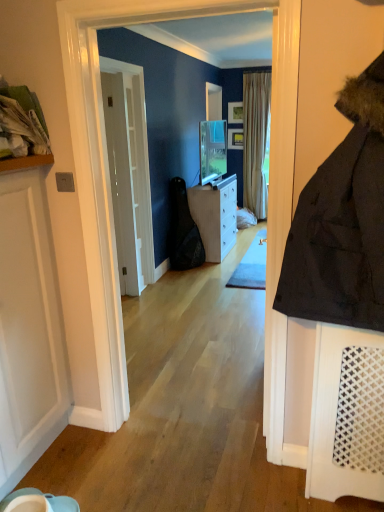
Question: Is white matte door at left, marked as the 2th door in a back-to-front arrangement, taller than white glossy cabinet at center?

Choices:
 (A) yes
 (B) no

Answer: (A)

Question: From the image's perspective, is white matte door at left, marked as the 2th door in a back-to-front arrangement, beneath white glossy cabinet at center?

Choices:
 (A) yes
 (B) no

Answer: (A)

Question: From the image's perspective, would you say white matte door at left, the 1th door viewed from the front, is positioned over white glossy cabinet at center?

Choices:
 (A) no
 (B) yes

Answer: (A)

Question: Considering the relative sizes of white matte door at left, the 1th door viewed from the front, and white glossy cabinet at center in the image provided, is white matte door at left, the 1th door viewed from the front, smaller than white glossy cabinet at center?

Choices:
 (A) yes
 (B) no

Answer: (A)

Question: Does white matte door at left, marked as the 2th door in a back-to-front arrangement, turn towards white glossy cabinet at center?

Choices:
 (A) no
 (B) yes

Answer: (A)

Question: Can you confirm if white matte door at left, the 1th door viewed from the front, is positioned to the left of white glossy cabinet at center?

Choices:
 (A) yes
 (B) no

Answer: (A)

Question: Considering the relative sizes of white glossy cabinet at center and white matte door at left, marked as the 2th door in a back-to-front arrangement, in the image provided, is white glossy cabinet at center taller than white matte door at left, marked as the 2th door in a back-to-front arrangement,?

Choices:
 (A) no
 (B) yes

Answer: (A)

Question: Can you confirm if white glossy cabinet at center is wider than white matte door at left, marked as the 2th door in a back-to-front arrangement?

Choices:
 (A) no
 (B) yes

Answer: (B)

Question: Could you tell me if white glossy cabinet at center is turned towards white matte door at left, marked as the 2th door in a back-to-front arrangement?

Choices:
 (A) no
 (B) yes

Answer: (A)

Question: Does white glossy cabinet at center contain white matte door at left, the 1th door viewed from the front?

Choices:
 (A) no
 (B) yes

Answer: (A)

Question: Is white glossy cabinet at center far away from white matte door at left, the 1th door viewed from the front?

Choices:
 (A) yes
 (B) no

Answer: (A)

Question: Considering the relative positions of white glossy cabinet at center and white matte door at left, the 1th door viewed from the front, in the image provided, is white glossy cabinet at center behind white matte door at left, the 1th door viewed from the front,?

Choices:
 (A) no
 (B) yes

Answer: (B)

Question: Does striped fabric curtain at center have a greater width compared to white matte door at left, marked as the 2th door in a back-to-front arrangement?

Choices:
 (A) no
 (B) yes

Answer: (B)